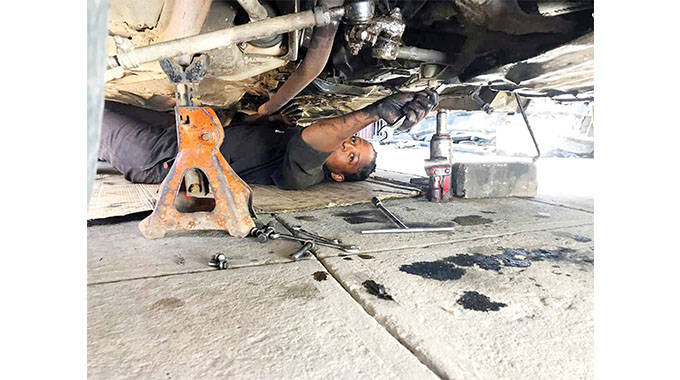
Image resolution: width=680 pixels, height=380 pixels. What are the coordinates of `cement flooring tiles` in the screenshot? It's located at (272, 329), (515, 341), (506, 208), (116, 251).